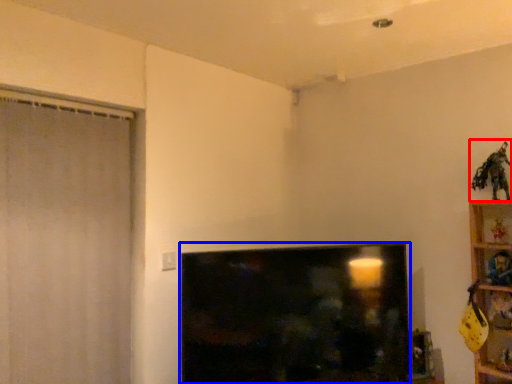
Question: Which of the following is the farthest to the observer, toy (highlighted by a red box) or television (highlighted by a blue box)?

Choices:
 (A) toy
 (B) television

Answer: (A)